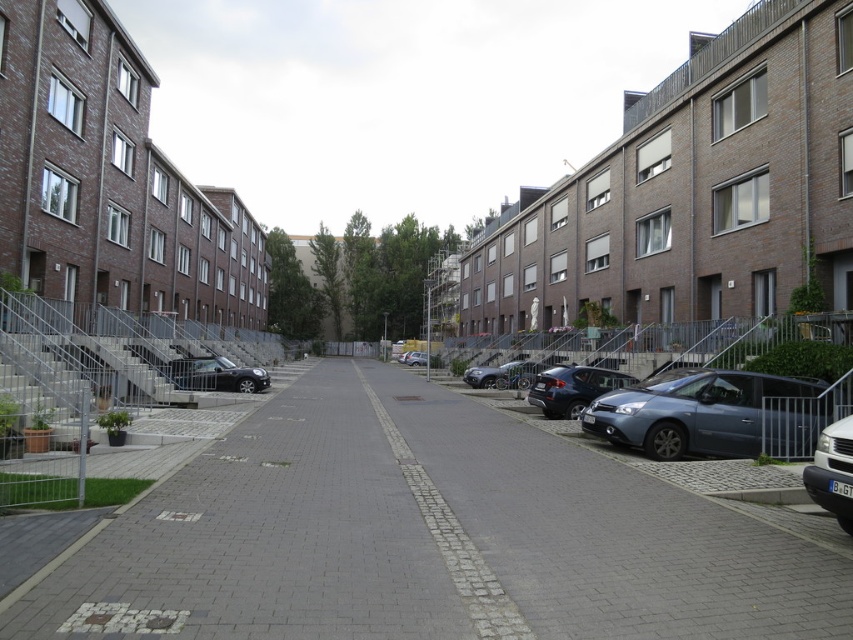
Question: Does gray cobblestone pavement at center appear on the right side of metallic gray car at right?

Choices:
 (A) yes
 (B) no

Answer: (B)

Question: Which of these objects is positioned farthest from the white matte van at lower right?

Choices:
 (A) satin black car at center
 (B) shiny silver car at center-right
 (C) satin silver sedan at center
 (D) gray cobblestone pavement at center

Answer: (C)

Question: Can you confirm if gray cobblestone pavement at center is positioned to the right of white matte van at lower right?

Choices:
 (A) yes
 (B) no

Answer: (B)

Question: Which object is positioned closest to the metallic gray car at right?

Choices:
 (A) satin silver sedan at center
 (B) white matte van at lower right

Answer: (B)

Question: Among these points, which one is nearest to the camera?

Choices:
 (A) (666, 372)
 (B) (231, 388)
 (C) (607, 372)

Answer: (A)

Question: Does metallic gray car at right have a smaller size compared to white matte van at lower right?

Choices:
 (A) no
 (B) yes

Answer: (A)